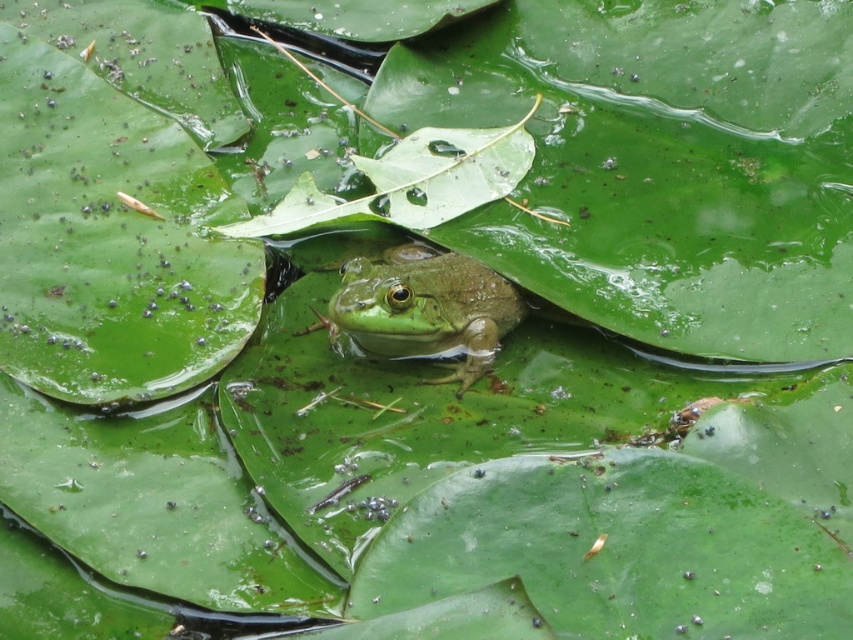
Does green matte tree frog at center have a smaller size compared to green matte leaf at center?

Correct, green matte tree frog at center occupies less space than green matte leaf at center.

Who is more forward, (413, 292) or (434, 198)?

Point (413, 292) is more forward.

Locate an element on the screen. This screenshot has height=640, width=853. green matte tree frog at center is located at coordinates (424, 307).